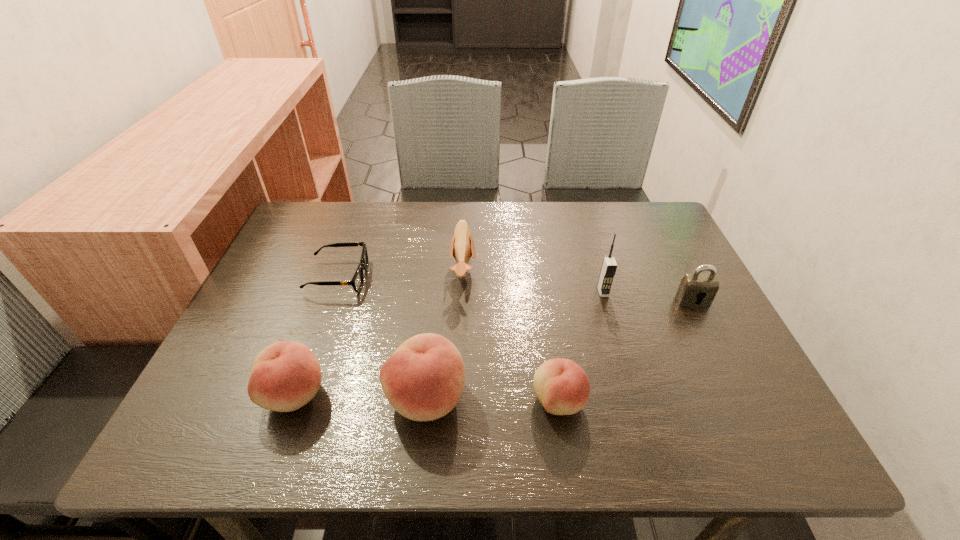
Please point a spot on the right to add another peach. Please provide its 2D coordinates. Your answer should be formatted as a tuple, i.e. [(x, y)], where the tuple contains the x and y coordinates of a point satisfying the conditions above.

[(693, 404)]